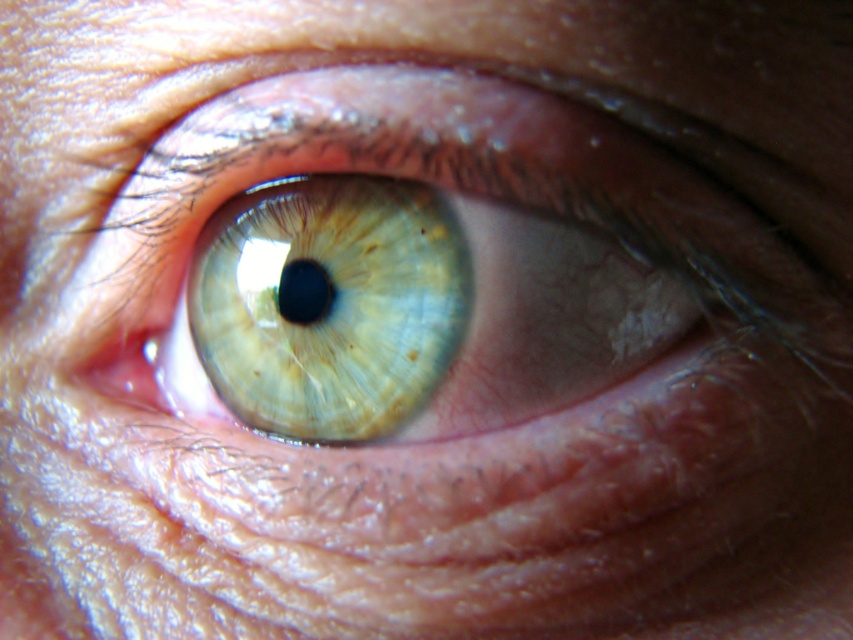
Question: Does green translucent eye at center appear on the right side of translucent yellow-green iris at center?

Choices:
 (A) no
 (B) yes

Answer: (B)

Question: Which point is farther to the camera?

Choices:
 (A) (312, 273)
 (B) (227, 221)

Answer: (B)

Question: Which point is closer to the camera?

Choices:
 (A) green translucent eye at center
 (B) translucent yellow-green iris at center

Answer: (A)

Question: Which object appears closest to the camera in this image?

Choices:
 (A) green translucent eye at center
 (B) translucent yellow-green iris at center

Answer: (A)

Question: Observing the image, what is the correct spatial positioning of green translucent eye at center in reference to translucent yellow-green iris at center?

Choices:
 (A) left
 (B) right

Answer: (B)

Question: Does green translucent eye at center appear under translucent yellow-green iris at center?

Choices:
 (A) yes
 (B) no

Answer: (A)